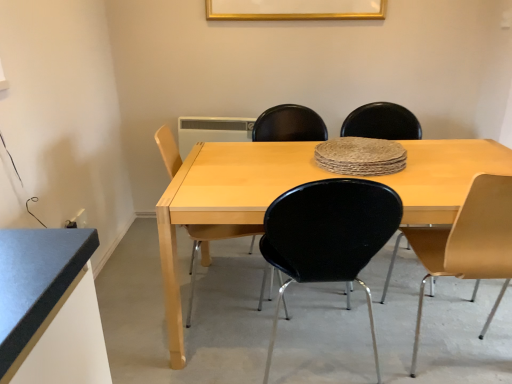
What are the coordinates of `vacant space behind glossy black chair at center, placed as the third chair when sorted from right to left` in the screenshot? It's located at (313, 301).